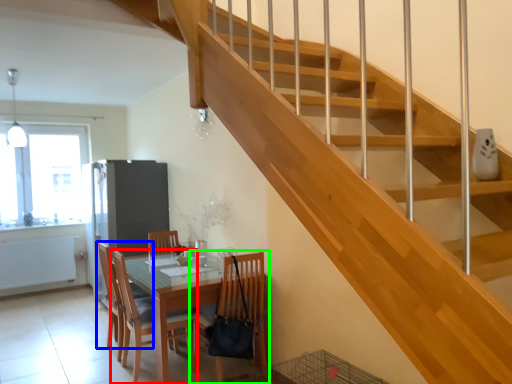
Question: Estimate the real-world distances between objects in this image. Which object is closer to chair (highlighted by a red box), chair (highlighted by a blue box) or chair (highlighted by a green box)?

Choices:
 (A) chair
 (B) chair

Answer: (A)